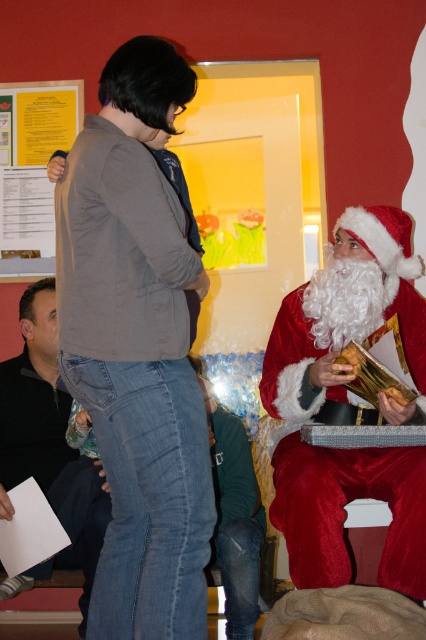
Does point (278, 328) lie in front of point (54, 134)?

Yes, point (278, 328) is closer to viewer.

Who is positioned more to the left, velvet red santa at right or yellow paper at upper left?

yellow paper at upper left is more to the left.

Is point (359, 460) positioned after point (23, 250)?

That is False.

The image size is (426, 640). Identify the location of velvet red santa at right. (348, 403).

Who is positioned more to the left, denim jeans at center or velvet red santa at right?

From the viewer's perspective, denim jeans at center appears more on the left side.

Who is positioned more to the right, denim jeans at center or velvet red santa at right?

From the viewer's perspective, velvet red santa at right appears more on the right side.

Between point (138, 582) and point (419, 474), which one is positioned in front?

Point (138, 582)

You are a GUI agent. You are given a task and a screenshot of the screen. Output one action in this format:
    pyautogui.click(x=<x>, y=<y>)
    Task: Click on the denim jeans at center
    Image resolution: width=426 pixels, height=640 pixels.
    Given the screenshot: What is the action you would take?
    pyautogui.click(x=137, y=349)

Can you confirm if denim jeans at center is thinner than yellow paper at upper left?

No, denim jeans at center is not thinner than yellow paper at upper left.

Can you confirm if denim jeans at center is wider than yellow paper at upper left?

Yes, denim jeans at center is wider than yellow paper at upper left.

Is point (121, 97) behind point (46, 195)?

No, it is in front of (46, 195).

Locate an element on the screen. This screenshot has width=426, height=640. denim jeans at center is located at coordinates (137, 349).